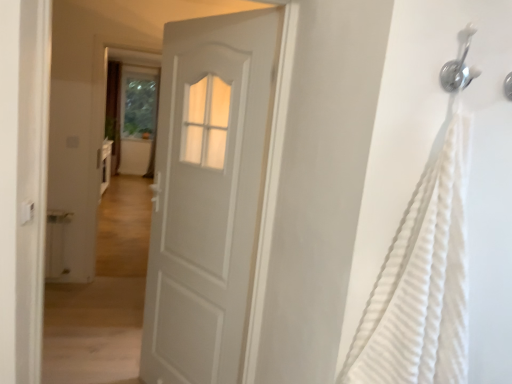
Question: Is transparent glass screen door at upper center wider or thinner than white matte door at center?

Choices:
 (A) wide
 (B) thin

Answer: (A)

Question: From a real-world perspective, is transparent glass screen door at upper center physically located above or below white matte door at center?

Choices:
 (A) below
 (B) above

Answer: (B)

Question: Which of these objects is positioned closest to the white matte door at center?

Choices:
 (A) silver metallic shower head at upper right
 (B) white textured fabric at right
 (C) transparent glass screen door at upper center

Answer: (B)

Question: Which object is positioned farthest from the white textured fabric at right?

Choices:
 (A) transparent glass screen door at upper center
 (B) white matte door at center
 (C) silver metallic shower head at upper right

Answer: (A)